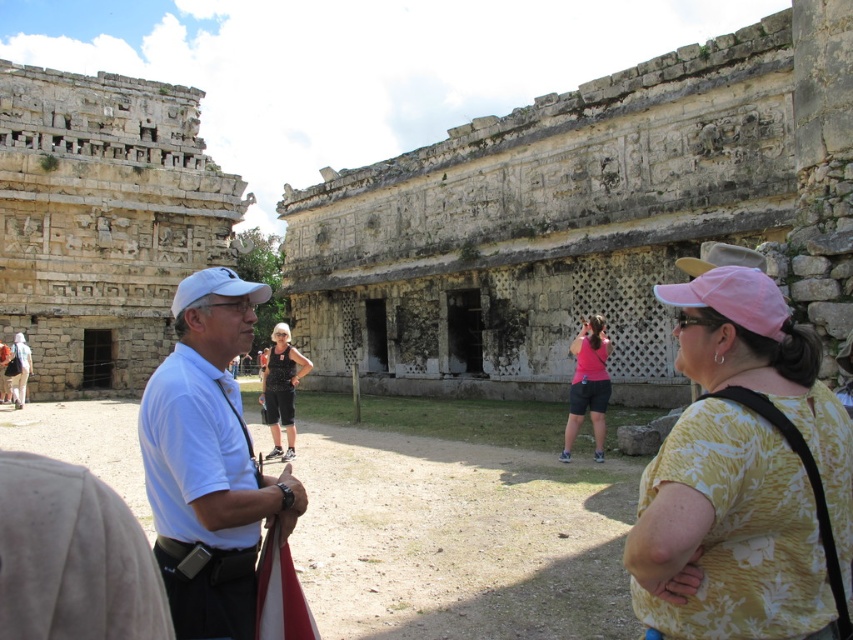
Question: Is weathered stone ruins at center closer to camera compared to dark gray shorts at center?

Choices:
 (A) yes
 (B) no

Answer: (A)

Question: Which point is closer to the camera?

Choices:
 (A) (19, 401)
 (B) (265, 364)
 (C) (196, 289)

Answer: (C)

Question: Among these objects, which one is farthest from the camera?

Choices:
 (A) white shirt at center
 (B) dark gray shorts at center
 (C) yellow floral shirt at center
 (D) weathered stone ruins at center

Answer: (B)

Question: Among these points, which one is nearest to the camera?

Choices:
 (A) (595, 179)
 (B) (265, 401)
 (C) (224, 285)

Answer: (C)

Question: Where is white fabric baseball cap at center located in relation to matte black backpack at left in the image?

Choices:
 (A) above
 (B) below

Answer: (A)

Question: Does weathered stone ruins at center have a lesser width compared to pink fabric at center?

Choices:
 (A) yes
 (B) no

Answer: (B)